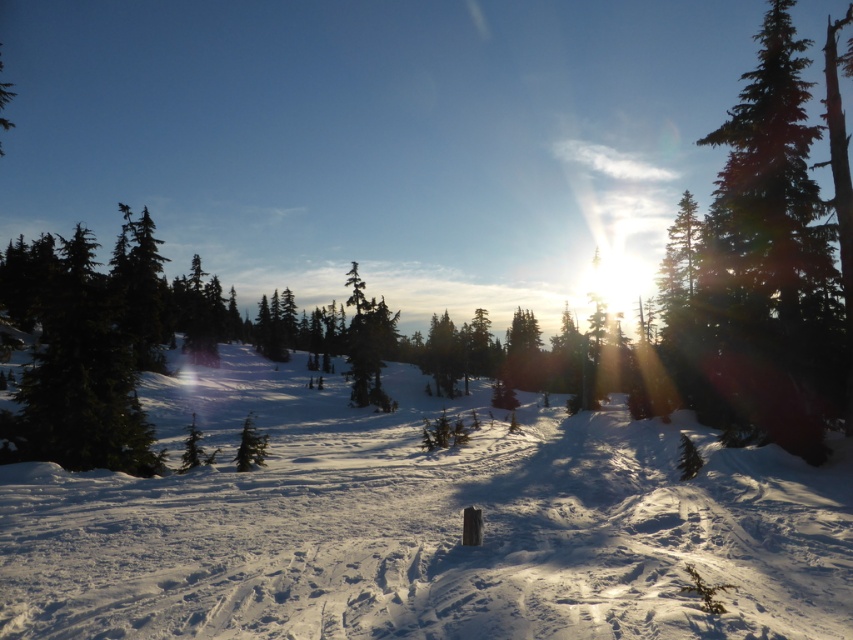
Question: Is white powdery snow at center closer to camera compared to green textured pine tree at right?

Choices:
 (A) no
 (B) yes

Answer: (B)

Question: Does white powdery snow at center appear over green textured pine tree at right?

Choices:
 (A) yes
 (B) no

Answer: (B)

Question: Which of the following is the farthest from the observer?

Choices:
 (A) green textured pine tree at right
 (B) white powdery snow at center

Answer: (A)

Question: Among these points, which one is nearest to the camera?

Choices:
 (A) click(x=206, y=481)
 (B) click(x=827, y=268)

Answer: (A)

Question: Is white powdery snow at center bigger than green textured pine tree at right?

Choices:
 (A) no
 (B) yes

Answer: (A)

Question: Among these objects, which one is nearest to the camera?

Choices:
 (A) white powdery snow at center
 (B) green textured pine tree at right

Answer: (A)